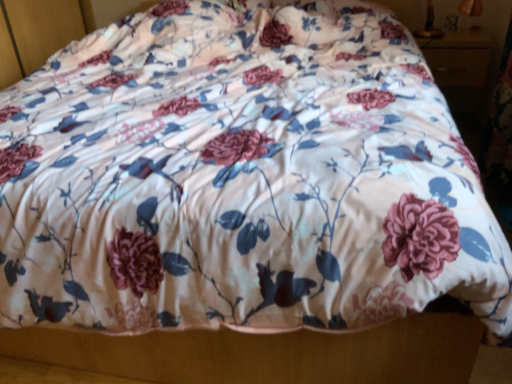
The height and width of the screenshot is (384, 512). What do you see at coordinates (459, 67) in the screenshot? I see `wooden drawer at upper right` at bounding box center [459, 67].

Locate an element on the screen. This screenshot has width=512, height=384. wooden drawer at upper right is located at coordinates (459, 67).

You are a GUI agent. You are given a task and a screenshot of the screen. Output one action in this format:
    pyautogui.click(x=<x>, y=<y>)
    Task: Click on the wooden drawer at upper right
    The height and width of the screenshot is (384, 512).
    Given the screenshot: What is the action you would take?
    pyautogui.click(x=459, y=67)